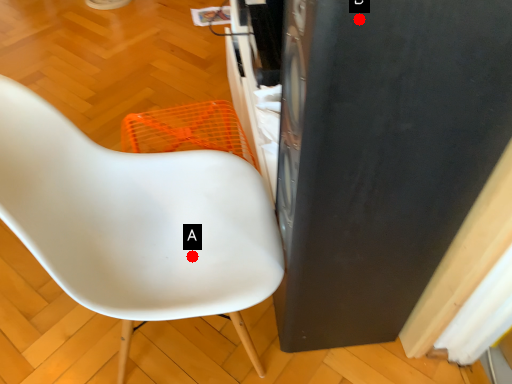
Question: Two points are circled on the image, labeled by A and B beside each circle. Among these points, which one is farthest from the camera?

Choices:
 (A) A is further
 (B) B is further

Answer: (A)